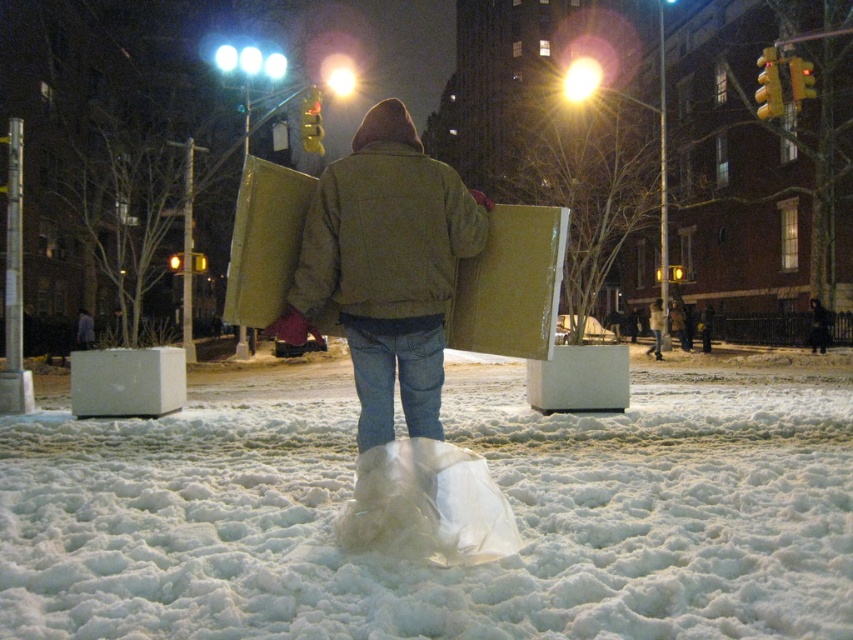
Question: Observing the image, what is the correct spatial positioning of white fluffy snow at center in reference to matte brown jacket at center?

Choices:
 (A) above
 (B) below

Answer: (B)

Question: Considering the relative positions of white fluffy snow at center and matte brown jacket at center in the image provided, where is white fluffy snow at center located with respect to matte brown jacket at center?

Choices:
 (A) below
 (B) above

Answer: (A)

Question: Is white fluffy snow at center to the right of matte brown jacket at center from the viewer's perspective?

Choices:
 (A) yes
 (B) no

Answer: (A)

Question: Which point is farther from the camera taking this photo?

Choices:
 (A) (521, 467)
 (B) (434, 202)

Answer: (A)

Question: Which point is closer to the camera?

Choices:
 (A) matte brown jacket at center
 (B) white fluffy snow at center

Answer: (B)

Question: Which point is closer to the camera?

Choices:
 (A) white fluffy snow at center
 (B) matte brown jacket at center

Answer: (A)